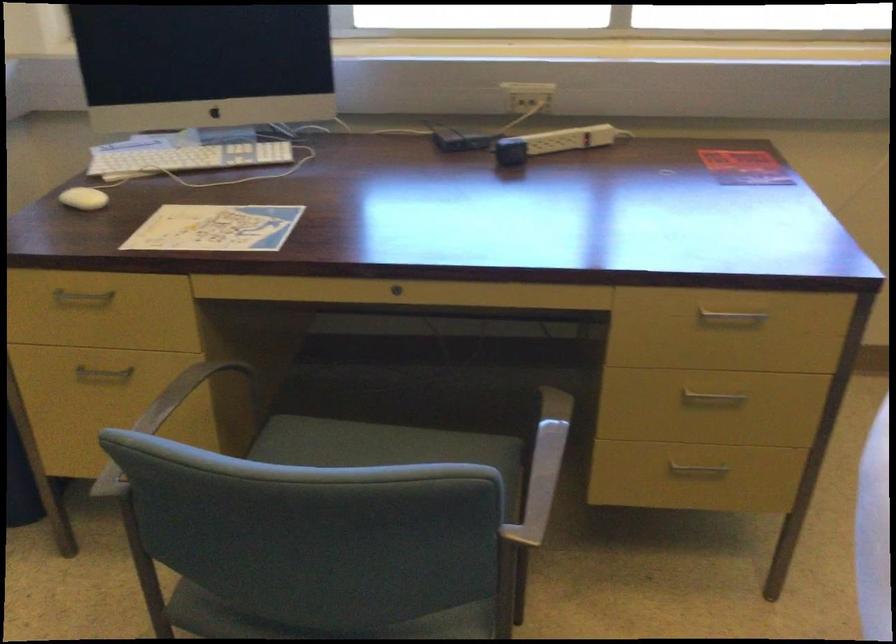
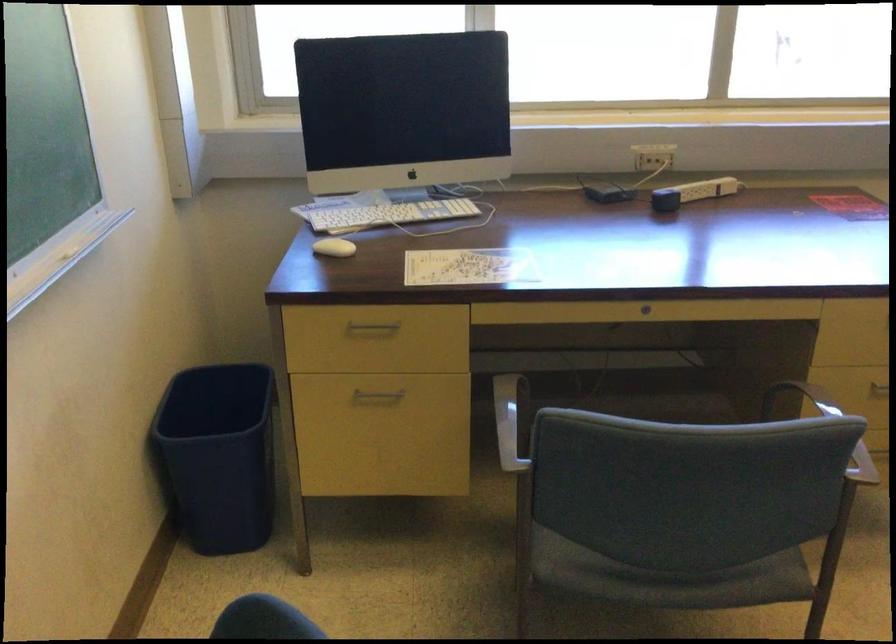
Find the pixel in the second image that matches [79,202] in the first image.

(333, 247)